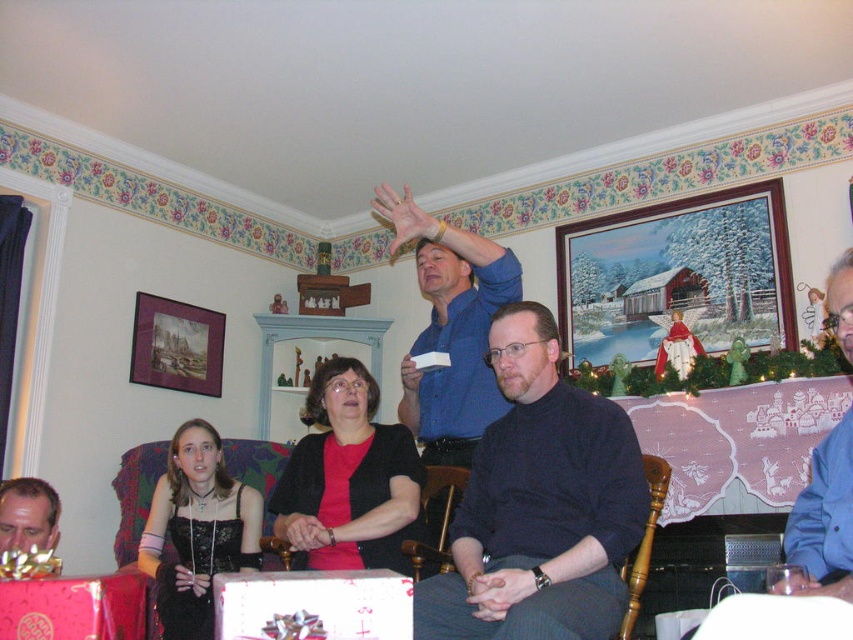
Does blue shirt at upper right have a lesser width compared to matte black hair at lower left?

Correct, blue shirt at upper right's width is less than matte black hair at lower left's.

Who is taller, blue shirt at upper right or matte black hair at lower left?

Standing taller between the two is blue shirt at upper right.

Where is `blue shirt at upper right`? The image size is (853, 640). blue shirt at upper right is located at coordinates (824, 518).

Does black matte shirt at center have a lesser width compared to matte black hair at lower left?

No.

Identify the location of black matte shirt at center. This screenshot has width=853, height=640. (538, 506).

At what (x,y) coordinates should I click in order to perform the action: click on black matte shirt at center. Please return your answer as a coordinate pair (x, y). Image resolution: width=853 pixels, height=640 pixels. Looking at the image, I should click on click(x=538, y=506).

Is black matte shirt at center to the left of blue shirt at center from the viewer's perspective?

In fact, black matte shirt at center is to the right of blue shirt at center.

What do you see at coordinates (538, 506) in the screenshot? I see `black matte shirt at center` at bounding box center [538, 506].

What do you see at coordinates (538, 506) in the screenshot? I see `black matte shirt at center` at bounding box center [538, 506].

You are a GUI agent. You are given a task and a screenshot of the screen. Output one action in this format:
    pyautogui.click(x=<x>, y=<y>)
    Task: Click on the black matte shirt at center
    This screenshot has height=640, width=853.
    Given the screenshot: What is the action you would take?
    pyautogui.click(x=538, y=506)